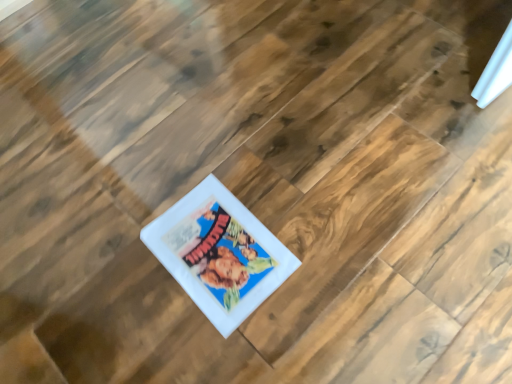
Locate an element on the screen. The width and height of the screenshot is (512, 384). vacant space in white plastic picture frame at center (from a real-world perspective) is located at coordinates (216, 246).